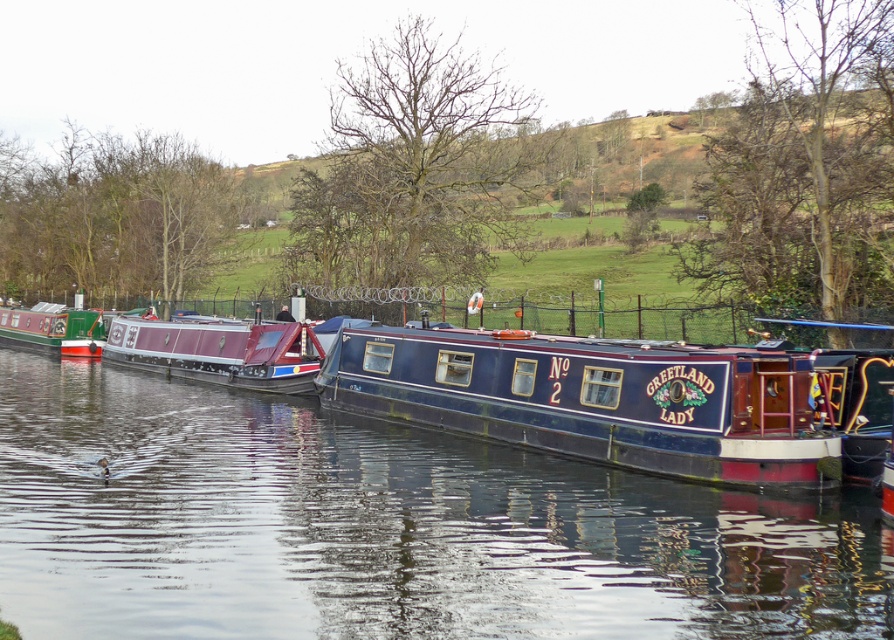
Who is higher up, maroon polished wood boat at center or green matte canal boat at left?

Positioned higher is green matte canal boat at left.

Is maroon polished wood boat at center smaller than green matte canal boat at left?

Incorrect, maroon polished wood boat at center is not smaller in size than green matte canal boat at left.

Image resolution: width=894 pixels, height=640 pixels. Describe the element at coordinates (218, 349) in the screenshot. I see `maroon polished wood boat at center` at that location.

The height and width of the screenshot is (640, 894). Find the location of `maroon polished wood boat at center`. maroon polished wood boat at center is located at coordinates (218, 349).

Where is `glossy blue water at center`? glossy blue water at center is located at coordinates (385, 529).

Does glossy blue water at center come behind green matte canal boat at left?

That is False.

Where is `glossy blue water at center`? Image resolution: width=894 pixels, height=640 pixels. glossy blue water at center is located at coordinates (385, 529).

Between point (432, 348) and point (110, 349), which one is positioned behind?

The point (110, 349) is more distant.

Is blue painted wood barge at center positioned at the back of maroon polished wood boat at center?

No, blue painted wood barge at center is closer to the viewer.

Between point (552, 374) and point (133, 356), which one is positioned in front?

Positioned in front is point (552, 374).

Identify the location of blue painted wood barge at center. This screenshot has width=894, height=640. (595, 400).